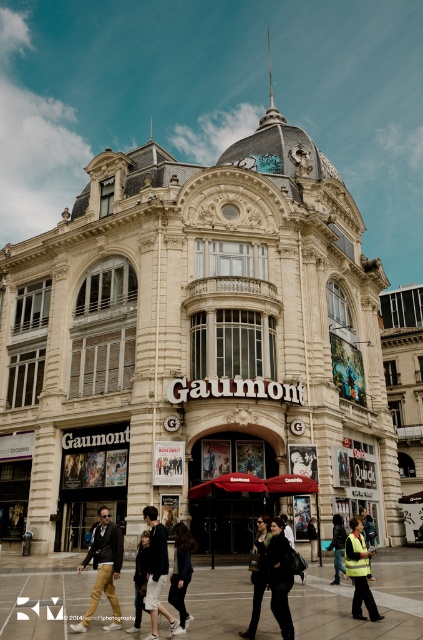
Can you confirm if khaki cotton pants at center is thinner than black leather jacket at center?

Incorrect, khaki cotton pants at center's width is not less than black leather jacket at center's.

Which is in front, point (107, 598) or point (272, 580)?

Point (272, 580)

Does point (98, 598) come behind point (285, 612)?

That is True.

You are a GUI agent. You are given a task and a screenshot of the screen. Output one action in this format:
    pyautogui.click(x=<x>, y=<y>)
    Task: Click on the khaki cotton pants at center
    
    Given the screenshot: What is the action you would take?
    pyautogui.click(x=104, y=568)

Is khaki cotton pants at center taller than reflective silver jacket at center?

Yes.

Does khaki cotton pants at center come in front of reflective silver jacket at center?

Yes, it is.

The width and height of the screenshot is (423, 640). Describe the element at coordinates (104, 568) in the screenshot. I see `khaki cotton pants at center` at that location.

The width and height of the screenshot is (423, 640). Identify the location of khaki cotton pants at center. (104, 568).

Does khaki cotton pants at center have a larger size compared to matte black jacket at center?

Indeed, khaki cotton pants at center has a larger size compared to matte black jacket at center.

Measure the distance between khaki cotton pants at center and camera.

khaki cotton pants at center is 84.51 feet from camera.

Which is behind, point (96, 588) or point (268, 544)?

Positioned behind is point (268, 544).

The image size is (423, 640). What are the coordinates of `khaki cotton pants at center` in the screenshot? It's located at (104, 568).